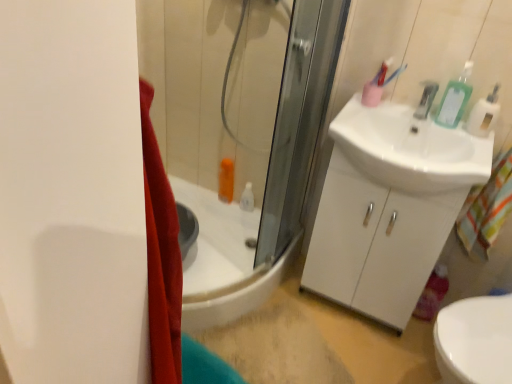
Question: Can we say metallic silver faucet at upper right lies outside white plastic soap dispenser at upper right?

Choices:
 (A) yes
 (B) no

Answer: (A)

Question: Can you confirm if metallic silver faucet at upper right is thinner than white plastic soap dispenser at upper right?

Choices:
 (A) no
 (B) yes

Answer: (A)

Question: From a real-world perspective, is metallic silver faucet at upper right on top of white plastic soap dispenser at upper right?

Choices:
 (A) yes
 (B) no

Answer: (B)

Question: Is metallic silver faucet at upper right to the right of white plastic soap dispenser at upper right from the viewer's perspective?

Choices:
 (A) no
 (B) yes

Answer: (A)

Question: Does metallic silver faucet at upper right come behind white plastic soap dispenser at upper right?

Choices:
 (A) yes
 (B) no

Answer: (A)

Question: Is metallic silver faucet at upper right closer to the viewer compared to white plastic soap dispenser at upper right?

Choices:
 (A) no
 (B) yes

Answer: (A)

Question: Is white glossy cabinet at right at the back of green plastic bottle at upper right?

Choices:
 (A) no
 (B) yes

Answer: (A)

Question: Is green plastic bottle at upper right far from white glossy cabinet at right?

Choices:
 (A) yes
 (B) no

Answer: (B)

Question: Is green plastic bottle at upper right bigger than white glossy cabinet at right?

Choices:
 (A) no
 (B) yes

Answer: (A)

Question: Is green plastic bottle at upper right outside white glossy cabinet at right?

Choices:
 (A) no
 (B) yes

Answer: (B)

Question: Does green plastic bottle at upper right have a lesser width compared to white glossy cabinet at right?

Choices:
 (A) yes
 (B) no

Answer: (A)

Question: From a real-world perspective, is green plastic bottle at upper right over white glossy cabinet at right?

Choices:
 (A) yes
 (B) no

Answer: (A)

Question: Can you confirm if white glossy sink at right is shorter than metallic silver faucet at upper right?

Choices:
 (A) no
 (B) yes

Answer: (A)